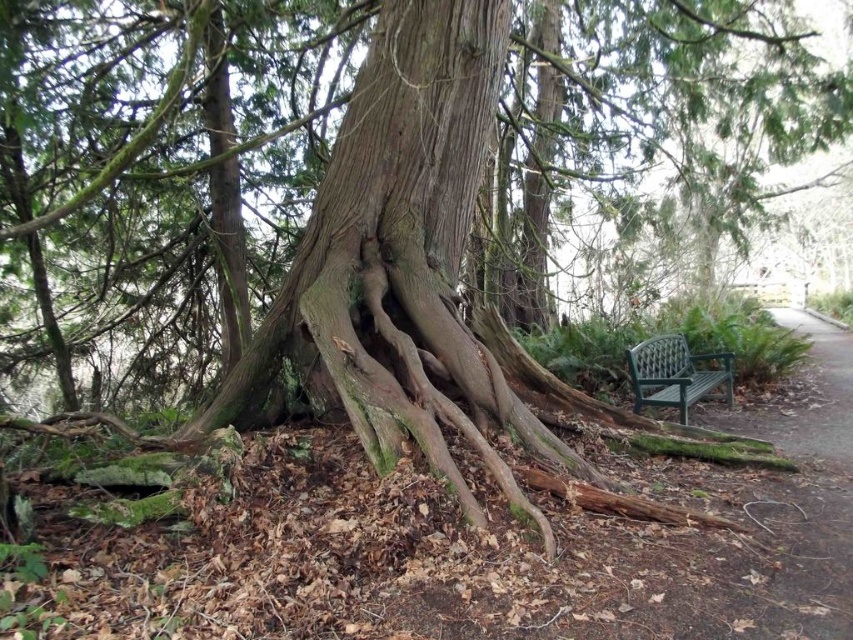
Between smooth brown bark at center and green plastic bench at right, which one has less height?

Standing shorter between the two is green plastic bench at right.

Between point (451, 205) and point (677, 356), which one is positioned behind?

The point (677, 356) is more distant.

Is point (399, 216) positioned behind point (637, 387)?

No, (399, 216) is closer to viewer.

Find the location of a particular element. This screenshot has height=640, width=853. smooth brown bark at center is located at coordinates (384, 173).